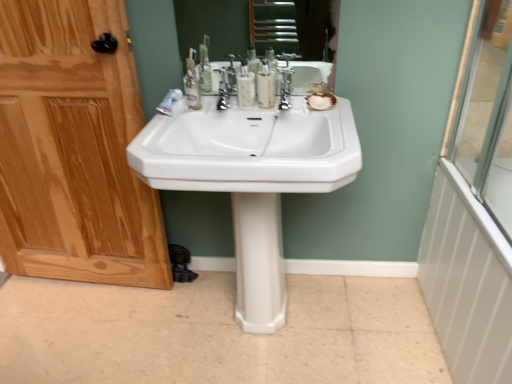
The image size is (512, 384). I want to click on vacant region below wooden door at left (from a real-world perspective), so [x=88, y=286].